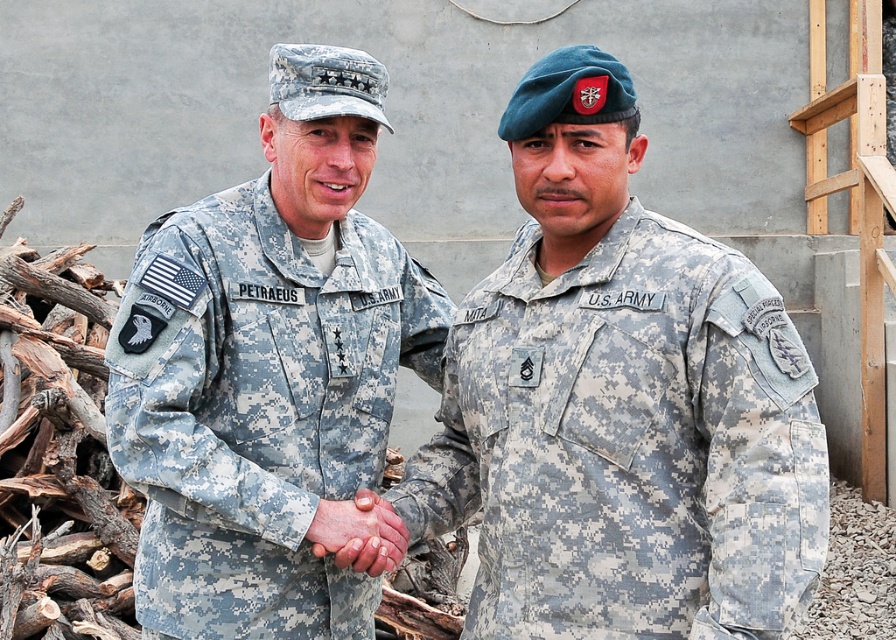
Is camouflage fabric us army uniform at center in front of camouflage fabric uniform at left?

Yes, it is.

Describe the element at coordinates (627, 444) in the screenshot. I see `camouflage fabric us army uniform at center` at that location.

Does point (596, 384) lie behind point (364, 634)?

No, (596, 384) is closer to viewer.

Where is `camouflage fabric us army uniform at center`? This screenshot has height=640, width=896. camouflage fabric us army uniform at center is located at coordinates (627, 444).